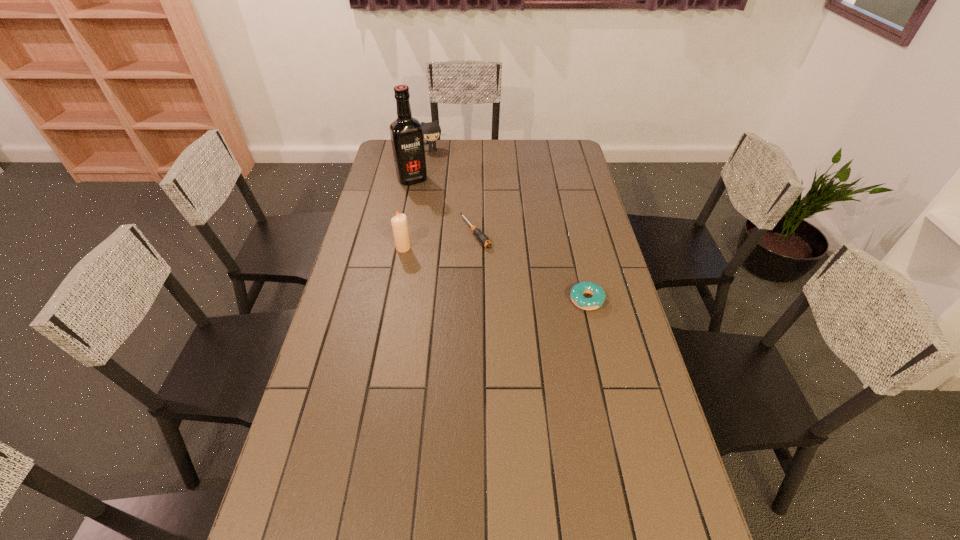
Identify the location of the second tallest object. This screenshot has width=960, height=540. (399, 223).

The height and width of the screenshot is (540, 960). In order to click on the rightmost object in this screenshot , I will do `click(577, 291)`.

At what (x,y) coordinates should I click in order to perform the action: click on the nearest object. Please return your answer as a coordinate pair (x, y). Looking at the image, I should click on (577, 291).

This screenshot has width=960, height=540. In order to click on kitten in this screenshot , I will do `click(431, 131)`.

At what (x,y) coordinates should I click in order to perform the action: click on the third tallest object. Please return your answer as a coordinate pair (x, y). This screenshot has height=540, width=960. Looking at the image, I should click on (431, 131).

At what (x,y) coordinates should I click in order to perform the action: click on screwdriver. Please return your answer as a coordinate pair (x, y). Image resolution: width=960 pixels, height=540 pixels. Looking at the image, I should click on (483, 239).

Find the location of `the second farthest object`. the second farthest object is located at coordinates (406, 132).

Find the location of `liquor`. liquor is located at coordinates (406, 132).

You are a GUI agent. You are given a task and a screenshot of the screen. Output one action in this format:
    pyautogui.click(x=<x>, y=<y>)
    Task: Click on the vacant space located on the front of the candle
    
    Given the screenshot: What is the action you would take?
    pyautogui.click(x=389, y=327)

Locate an element on the screen. This screenshot has height=540, width=960. vacant space located 0.240m on the back of the doughnut is located at coordinates (572, 240).